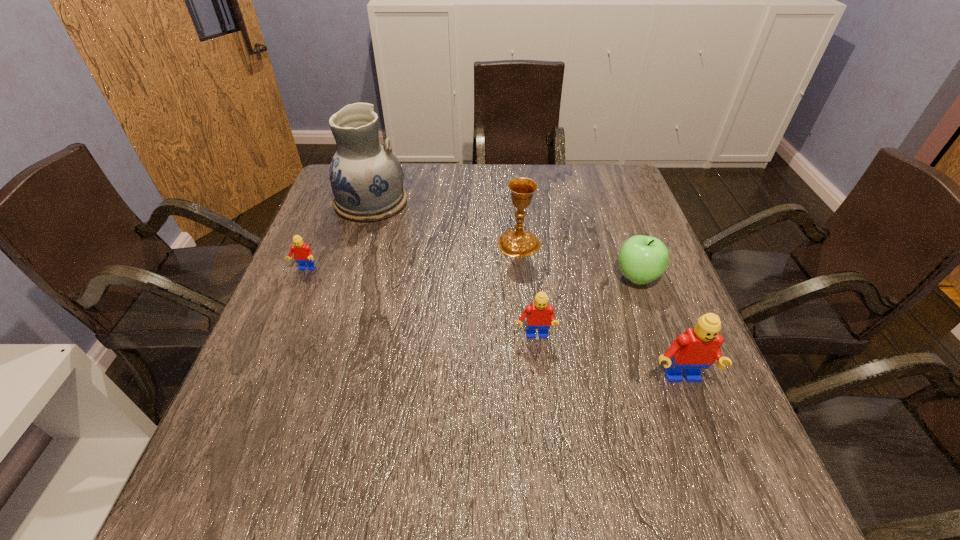
You are a GUI agent. You are given a task and a screenshot of the screen. Output one action in this format:
    pyautogui.click(x=<x>, y=<y>)
    Task: Click on the shortest Lego
    
    Given the screenshot: What is the action you would take?
    pyautogui.click(x=302, y=253)

In order to click on the farthest Lego in this screenshot , I will do `click(302, 253)`.

This screenshot has width=960, height=540. Find the location of `the second nearest Lego`. the second nearest Lego is located at coordinates (539, 315).

You are a GUI agent. You are given a task and a screenshot of the screen. Output one action in this format:
    pyautogui.click(x=<x>, y=<y>)
    Task: Click on the second tallest Lego
    The image size is (960, 540).
    Given the screenshot: What is the action you would take?
    pyautogui.click(x=539, y=315)

The image size is (960, 540). Identify the location of the rightmost Lego. (697, 348).

At what (x,y) coordinates should I click in order to perform the action: click on the tallest Lego. Please return your answer as a coordinate pair (x, y). Looking at the image, I should click on (697, 348).

At what (x,y) coordinates should I click in order to perform the action: click on the tallest object. Please return your answer as a coordinate pair (x, y). The image size is (960, 540). Looking at the image, I should click on (366, 177).

Locate an element on the screen. The height and width of the screenshot is (540, 960). the farthest object is located at coordinates (366, 177).

Identify the location of apple. This screenshot has width=960, height=540. (642, 259).

In order to click on the second farthest object in this screenshot , I will do `click(516, 242)`.